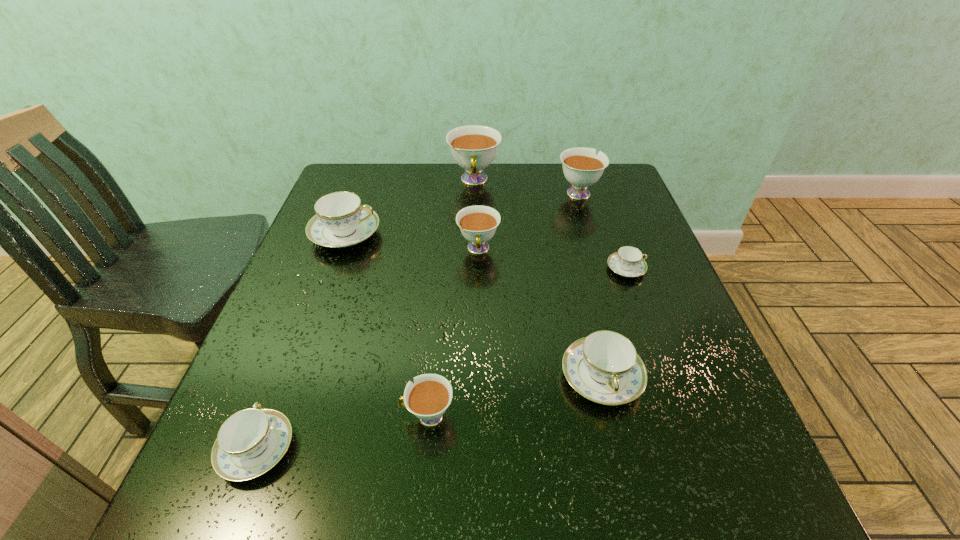
The width and height of the screenshot is (960, 540). Identify the location of blank region between the shortest object and the smallest white teacup. (527, 342).

You are a GUI agent. You are given a task and a screenshot of the screen. Output one action in this format:
    pyautogui.click(x=<x>, y=<y>)
    Task: Click on the empty space that is in between the tallest teacup and the smallest white teacup
    
    Given the screenshot: What is the action you would take?
    (x=451, y=299)

Locate which object ranks seventh in proximity to the nearest white teacup. Please provide its 2D coordinates. Your answer should be formatted as a tuple, i.e. [(x, y)], where the tuple contains the x and y coordinates of a point satisfying the conditions above.

[(582, 168)]

Where is `the sixth closest object to the second nearest blue teacup`? the sixth closest object to the second nearest blue teacup is located at coordinates (340, 221).

At what (x,y) coordinates should I click in order to perform the action: click on teacup object that ranks as the sixth closest to the biggest blue teacup. Please return your answer as a coordinate pair (x, y). Looking at the image, I should click on (604, 367).

Where is `teacup that stands as the sixth closest to the biggest white teacup`? teacup that stands as the sixth closest to the biggest white teacup is located at coordinates (428, 398).

Locate which white teacup is the second closest to the smallest white teacup. Please provide its 2D coordinates. Your answer should be formatted as a tuple, i.e. [(x, y)], where the tuple contains the x and y coordinates of a point satisfying the conditions above.

[(473, 147)]

Point out which white teacup is positioned as the third nearest to the second biggest blue teacup. Please provide its 2D coordinates. Your answer should be formatted as a tuple, i.e. [(x, y)], where the tuple contains the x and y coordinates of a point satisfying the conditions above.

[(582, 168)]

The height and width of the screenshot is (540, 960). What are the coordinates of `the third closest blue teacup relative to the nearest white teacup` in the screenshot? It's located at (340, 221).

The width and height of the screenshot is (960, 540). I want to click on blue teacup that is the second closest to the biggest blue teacup, so click(x=604, y=367).